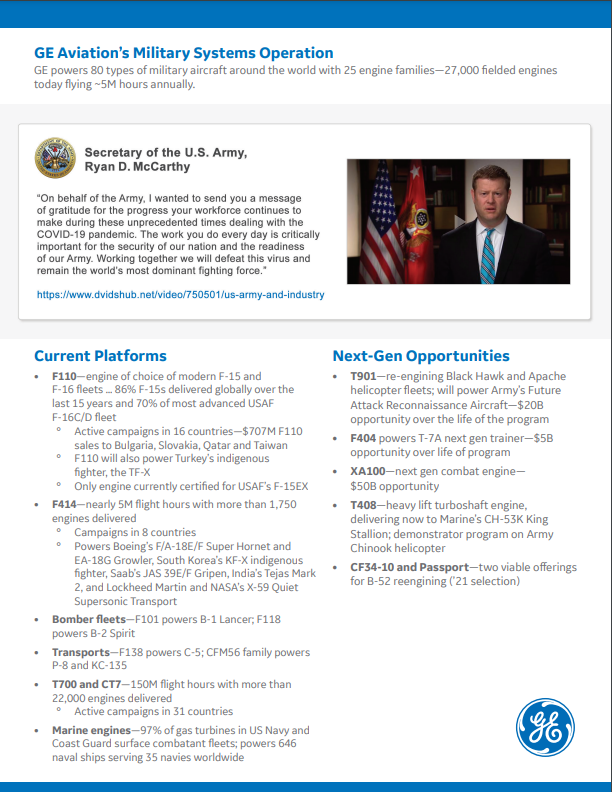
Identify the location of poster. (365, 694).